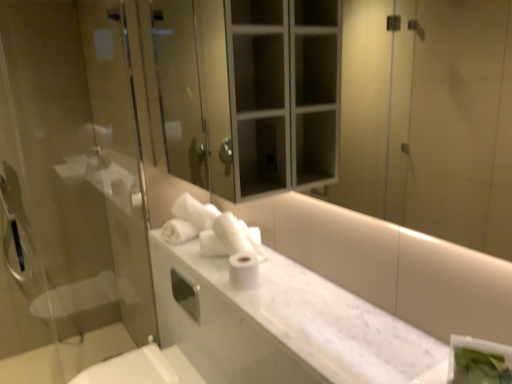
What do you see at coordinates (243, 270) in the screenshot? Image resolution: width=512 pixels, height=384 pixels. I see `white matte toilet paper at center` at bounding box center [243, 270].

Measure the distance between point [351,315] and camera.

A distance of 1.27 meters exists between point [351,315] and camera.

Where is `white matte toilet paper at center`? white matte toilet paper at center is located at coordinates (243, 270).

Considering the positions of objects white marble counter top at center and white glossy mirror at upper center in the image provided, who is behind, white marble counter top at center or white glossy mirror at upper center?

white marble counter top at center is further away from the camera.

Does white marble counter top at center have a greater height compared to white glossy mirror at upper center?

No, white marble counter top at center is not taller than white glossy mirror at upper center.

Is point (279, 269) behind point (234, 285)?

Yes.

Where is `counter top lying on the right of white matte toilet paper at center`? The height and width of the screenshot is (384, 512). counter top lying on the right of white matte toilet paper at center is located at coordinates (283, 325).

Can you confirm if white marble counter top at center is wider than white matte toilet paper at center?

Indeed, white marble counter top at center has a greater width compared to white matte toilet paper at center.

Between white matte toilet paper at center and white glossy mirror at upper center, which one has smaller width?

white glossy mirror at upper center.

From the picture: Is white matte toilet paper at center not inside white glossy mirror at upper center?

Indeed, white matte toilet paper at center is completely outside white glossy mirror at upper center.

Based on their positions, is white matte toilet paper at center located to the left or right of white glossy mirror at upper center?

Based on their positions, white matte toilet paper at center is located to the left of white glossy mirror at upper center.

From the image's perspective, which object appears higher, white marble counter top at center or transparent glass screen door at left?

transparent glass screen door at left is shown above in the image.

Is there a large distance between white marble counter top at center and transparent glass screen door at left?

No, white marble counter top at center is in close proximity to transparent glass screen door at left.

Based on the photo, does white marble counter top at center have a smaller size compared to transparent glass screen door at left?

Indeed, white marble counter top at center has a smaller size compared to transparent glass screen door at left.

From the picture: Can you tell me how much white marble counter top at center and transparent glass screen door at left differ in facing direction?

88.7 degrees.

From the image's perspective, is white glossy mirror at upper center located beneath white matte toilet paper at center?

No, from the image's perspective, white glossy mirror at upper center is not beneath white matte toilet paper at center.

Between white glossy mirror at upper center and white matte toilet paper at center, which one appears on the left side from the viewer's perspective?

white matte toilet paper at center.

From a real-world perspective, is white glossy mirror at upper center positioned above or below white matte toilet paper at center?

In terms of real-world spatial position, white glossy mirror at upper center is above white matte toilet paper at center.

Could you tell me if white glossy mirror at upper center is turned towards white matte toilet paper at center?

No.

Would you say transparent glass screen door at left contains white marble counter top at center?

Answer: Definitely not — white marble counter top at center is not inside transparent glass screen door at left.

From a real-world perspective, which is physically above, transparent glass screen door at left or white marble counter top at center?

transparent glass screen door at left, from a real-world perspective.

I want to click on counter top that appears below the transparent glass screen door at left (from a real-world perspective), so click(x=283, y=325).

From the image's perspective, which one is positioned higher, transparent glass screen door at left or white marble counter top at center?

transparent glass screen door at left is shown above in the image.

From the image's perspective, between white matte toilet paper at center and transparent glass screen door at left, which one is located above?

transparent glass screen door at left is shown above in the image.

Does white matte toilet paper at center lie in front of transparent glass screen door at left?

Yes, white matte toilet paper at center is closer to the viewer.

Does white matte toilet paper at center appear on the right side of transparent glass screen door at left?

Yes.

Is point (233, 271) positioned in front of point (28, 208)?

Yes.

This screenshot has height=384, width=512. I want to click on mirror positioned vertically above the white marble counter top at center (from a real-world perspective), so click(x=429, y=118).

In order to click on counter top that is below the white matte toilet paper at center (from the image's perspective) in this screenshot , I will do `click(283, 325)`.

From the image, which object appears to be nearer to white glossy mirror at upper center, white marble counter top at center or transparent glass screen door at left?

white marble counter top at center is positioned closer to the anchor white glossy mirror at upper center.

Looking at the image, which one is located closer to transparent glass screen door at left, white marble counter top at center or white glossy mirror at upper center?

white marble counter top at center is closer to transparent glass screen door at left.

Which object lies nearer to the anchor point white marble counter top at center, transparent glass screen door at left or white matte toilet paper at center?

white matte toilet paper at center is closer to white marble counter top at center.

From the picture: Considering their positions, is transparent glass screen door at left positioned further to white marble counter top at center than white glossy mirror at upper center?

white glossy mirror at upper center is further to white marble counter top at center.

When comparing their distances from white marble counter top at center, does white matte toilet paper at center or transparent glass screen door at left seem further?

transparent glass screen door at left lies further to white marble counter top at center than the other object.

Looking at the image, which one is located closer to white marble counter top at center, white glossy mirror at upper center or white matte toilet paper at center?

white matte toilet paper at center.

When comparing their distances from white glossy mirror at upper center, does white marble counter top at center or white matte toilet paper at center seem closer?

The object closer to white glossy mirror at upper center is white marble counter top at center.

When comparing their distances from white matte toilet paper at center, does white marble counter top at center or transparent glass screen door at left seem closer?

Among the two, white marble counter top at center is located nearer to white matte toilet paper at center.

Locate an element on the screen. This screenshot has width=512, height=384. toilet paper between transparent glass screen door at left and white marble counter top at center from left to right is located at coordinates (243, 270).

This screenshot has width=512, height=384. I want to click on toilet paper between transparent glass screen door at left and white glossy mirror at upper center from left to right, so click(243, 270).

Identify the location of counter top between transparent glass screen door at left and white glossy mirror at upper center. Image resolution: width=512 pixels, height=384 pixels. (283, 325).

This screenshot has width=512, height=384. In order to click on counter top between white glossy mirror at upper center and white matte toilet paper at center along the z-axis in this screenshot , I will do `click(283, 325)`.